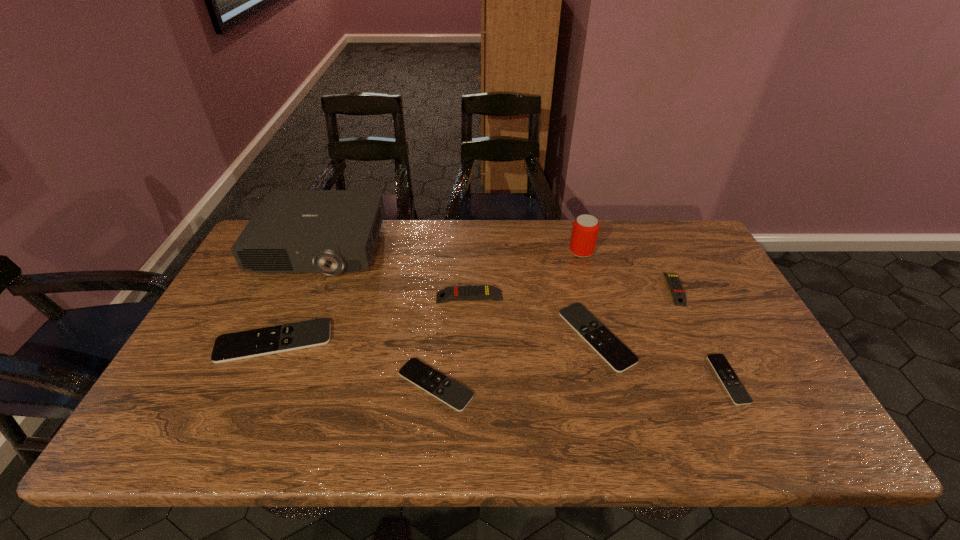
At what (x,y) coordinates should I click in order to perform the action: click on free space in the image that satisfies the following two spatial constraints: 1. on the front side of the third tallest remote control; 2. on the right side of the shortest remote control. Please return your answer as a coordinate pair (x, y). Image resolution: width=960 pixels, height=540 pixels. Looking at the image, I should click on (257, 379).

This screenshot has height=540, width=960. Find the location of `free space that satisfies the following two spatial constraints: 1. on the back side of the second smallest black remote control; 2. on the left side of the smaller yellow remote control`. free space that satisfies the following two spatial constraints: 1. on the back side of the second smallest black remote control; 2. on the left side of the smaller yellow remote control is located at coordinates (444, 288).